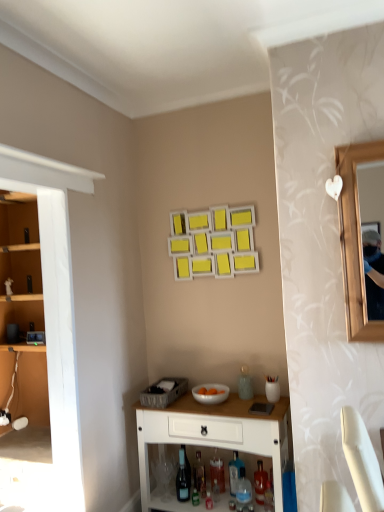
This screenshot has width=384, height=512. I want to click on vacant space in front of white glossy bowl at lower center, so coord(221,413).